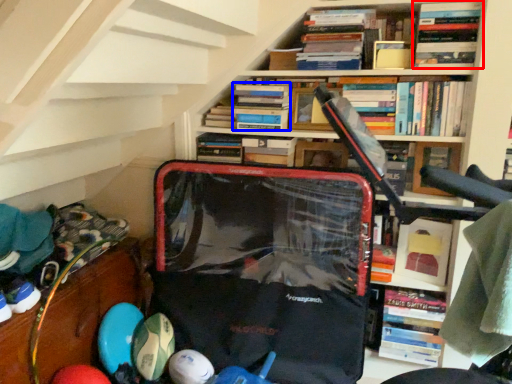
Question: Which of the following is the farthest to the observer, book (highlighted by a red box) or book (highlighted by a blue box)?

Choices:
 (A) book
 (B) book

Answer: (B)